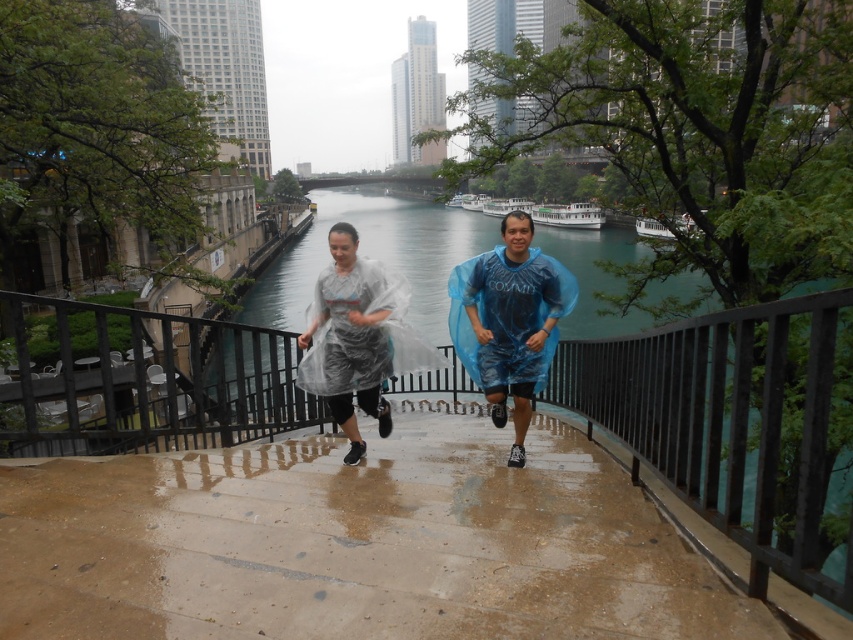
You are a drone operator trying to capture a photo of the brown concrete stairs at center. The camera is currently positioned at point 0.7, 0.3. To frame the stairs properly, you need to adjust the camera to the correct coordinates. What should the new coordinates be?

The brown concrete stairs at center are located at point (354,545), so the camera should be adjusted to those coordinates to capture them properly.

Looking at this image, you are a photographer trying to capture the two runners on the staircase. You want to ensure that the blue translucent poncho at center and the transparent plastic poncho at center are both clearly visible in your photo. Which poncho should you focus on first to ensure it doesn t get blocked by the other?

The blue translucent poncho at center is positioned under the transparent plastic poncho at center, so you should focus on the transparent plastic poncho at center first to ensure it isn t blocked by the blue one above it.

You are a delivery robot with a width of 1.5 meters. You need to pass between the blue translucent poncho at center and the transparent plastic poncho at center. Can you fit through the space between them?

The distance between the blue translucent poncho at center and the transparent plastic poncho at center is 1.58 meters. Since the robot is 1.5 meters wide, it can fit through the space as there is enough clearance.